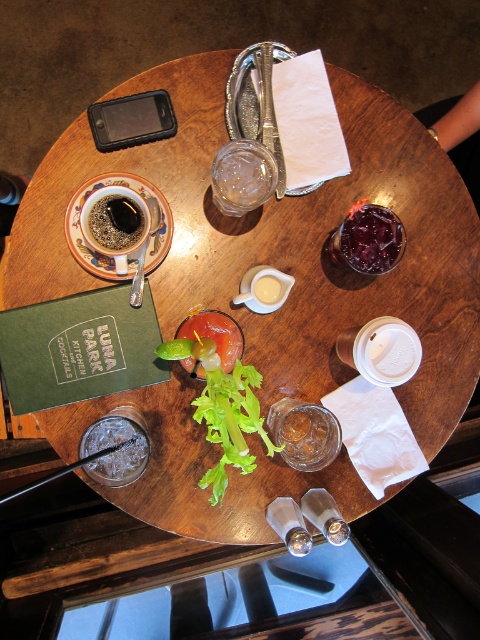
Question: Where is matte ceramic cup at upper left located in relation to matte black coffee cup at upper left in the image?

Choices:
 (A) right
 (B) left

Answer: (A)

Question: Considering the real-world distances, which object is closest to the metallic silverware at center?

Choices:
 (A) translucent glass with garnish at center
 (B) matte black coffee cup at upper left
 (C) matte ceramic cup at upper left

Answer: (C)

Question: Which point appears closest to the camera in this image?

Choices:
 (A) (207, 372)
 (B) (276, 186)

Answer: (A)

Question: Does matte ceramic cup at upper left appear on the left side of green leafy lettuce at center?

Choices:
 (A) no
 (B) yes

Answer: (B)

Question: Does metallic silverware at center appear on the left side of matte black coffee cup at upper left?

Choices:
 (A) no
 (B) yes

Answer: (A)

Question: Which point is farther to the camera?

Choices:
 (A) (268, 120)
 (B) (98, 218)

Answer: (A)